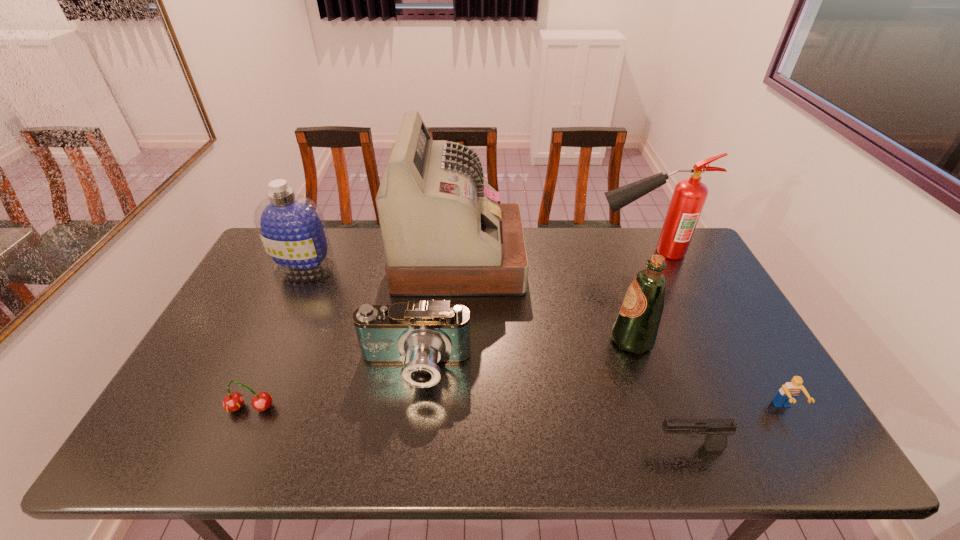
You are a GUI agent. You are given a task and a screenshot of the screen. Output one action in this format:
    pyautogui.click(x=<x>, y=<y>)
    Task: Click on the free space between the cherry and the fifth tallest object
    
    Given the screenshot: What is the action you would take?
    pyautogui.click(x=333, y=388)

Where is `free space between the cleansing agent and the olive oil`? This screenshot has width=960, height=540. free space between the cleansing agent and the olive oil is located at coordinates (468, 304).

I want to click on vacant space in between the cleansing agent and the Lego, so click(x=544, y=338).

At what (x,y) coordinates should I click in order to perform the action: click on free area in between the fourth shortest object and the fire extinguisher. Please return your answer as a coordinate pair (x, y). The height and width of the screenshot is (540, 960). Looking at the image, I should click on (529, 310).

At what (x,y) coordinates should I click in order to perform the action: click on free space between the Lego and the cleansing agent. Please return your answer as a coordinate pair (x, y). Image resolution: width=960 pixels, height=540 pixels. Looking at the image, I should click on (544, 338).

Locate an element on the screen. The height and width of the screenshot is (540, 960). object that is the seventh closest to the fire extinguisher is located at coordinates (233, 401).

Identify which object is located as the sixth nearest to the nearest object. Please provide its 2D coordinates. Your answer should be formatted as a tuple, i.e. [(x, y)], where the tuple contains the x and y coordinates of a point satisfying the conditions above.

[(233, 401)]

Identify the location of free location that satisfies the following two spatial constraints: 1. on the front-facing side of the olive oil; 2. with stems pointing upwards on the cherry. (655, 408).

The image size is (960, 540). What are the coordinates of `free spot that satisfies the following two spatial constraints: 1. on the face of the Lego; 2. aim along the barrel of the nearest object` in the screenshot? It's located at pyautogui.click(x=807, y=448).

Locate an element on the screen. This screenshot has width=960, height=540. free location that satisfies the following two spatial constraints: 1. on the face of the Lego; 2. aim along the barrel of the nearest object is located at coordinates (807, 448).